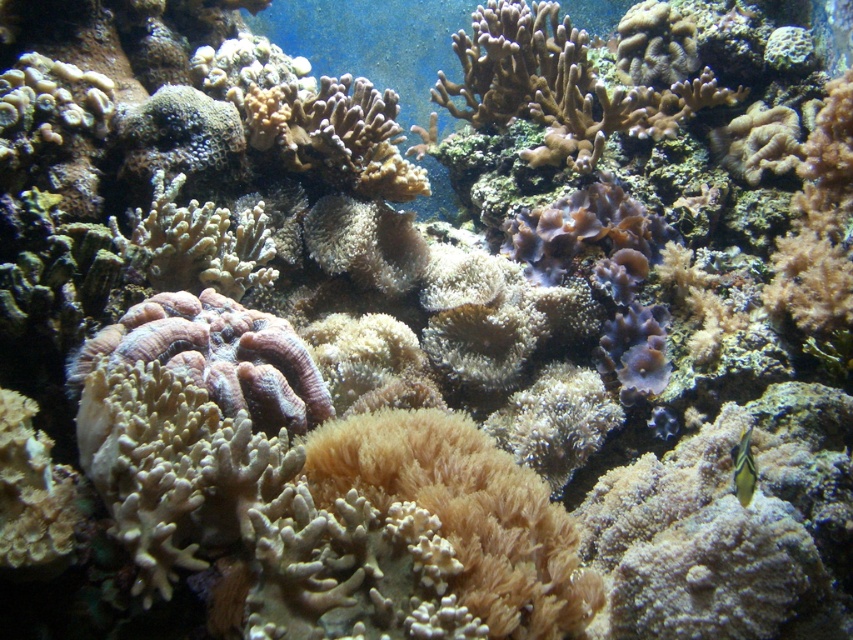
Question: Which point is closer to the camera taking this photo?

Choices:
 (A) (91, 369)
 (B) (747, 480)

Answer: (B)

Question: Which of the following is the farthest from the observer?

Choices:
 (A) (323, 388)
 (B) (750, 477)

Answer: (A)

Question: Is purple coral at center bigger than shiny yellow-green fish at center-right?

Choices:
 (A) yes
 (B) no

Answer: (A)

Question: Does purple coral at center appear over shiny yellow-green fish at center-right?

Choices:
 (A) no
 (B) yes

Answer: (B)

Question: Which object appears farthest from the camera in this image?

Choices:
 (A) shiny yellow-green fish at center-right
 (B) purple coral at center

Answer: (B)

Question: Is purple coral at center smaller than shiny yellow-green fish at center-right?

Choices:
 (A) no
 (B) yes

Answer: (A)